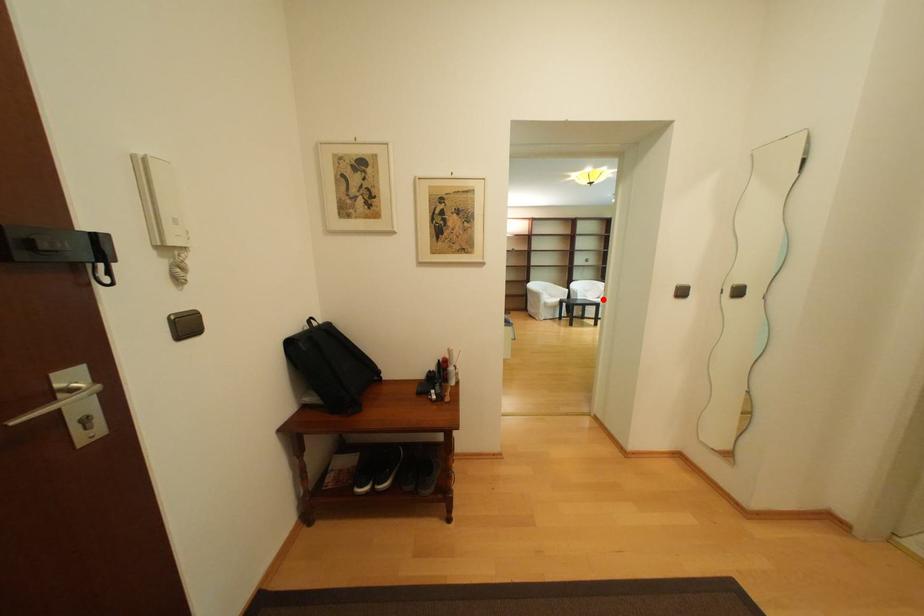
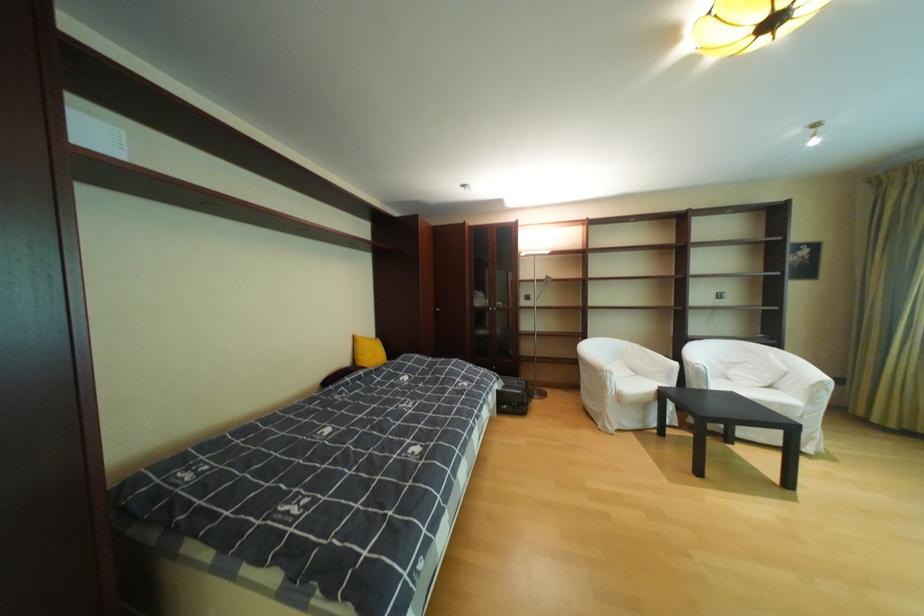
The point at the highlighted location is marked in the first image. Where is the corresponding point in the second image?

(763, 394)